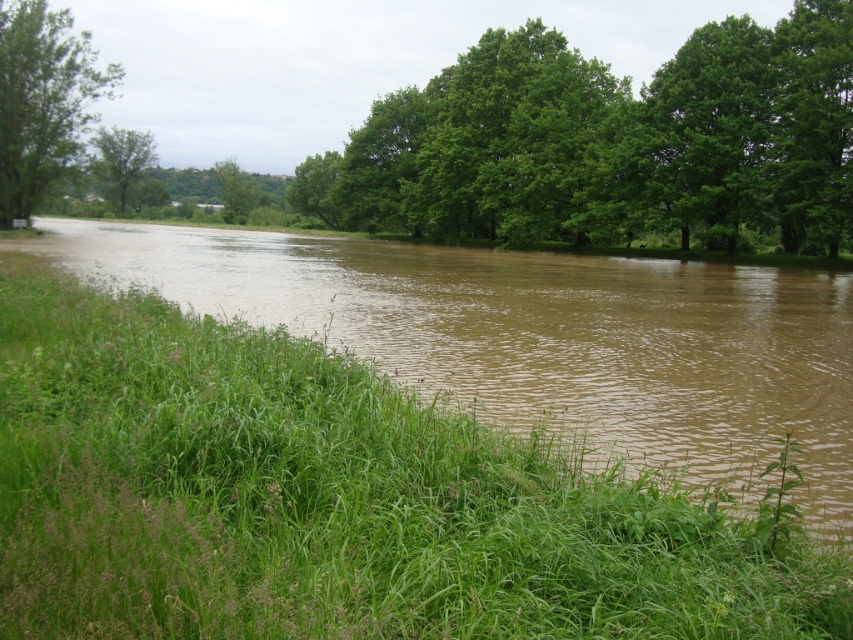
You are a hiker trying to cross the flooded area. You see the brown muddy water at center and the green leafy tree at center. Which one is closer to you?

The brown muddy water at center is in front of the green leafy tree at center, so it is closer to you.

You are a photographer standing at the edge of the flooded riverbank. You want to take a photo that includes both the point at coordinates point [323,204] and point [15,208]. Which point will appear closer to the bottom of the photo?

Point [15,208] will appear closer to the bottom of the photo because it is closer to the camera than point [323,204].

You are a hiker who needs to cross the flooded area. The brown muddy water at center and the green leafy tree at center are in your path. Which one do you need to avoid stepping into?

You should avoid stepping into the brown muddy water at center because its width is larger than the green leafy tree at center, making it more dangerous to cross.